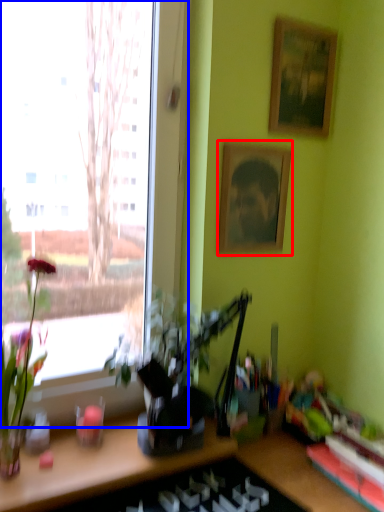
Question: Which of the following is the farthest to the observer, picture frame (highlighted by a red box) or window (highlighted by a blue box)?

Choices:
 (A) picture frame
 (B) window

Answer: (A)